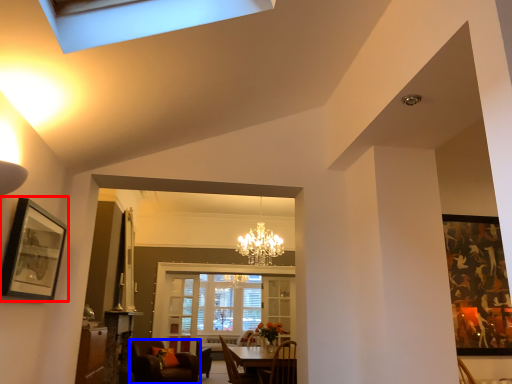
Question: Which point is further to the camera, picture frame (highlighted by a red box) or chair (highlighted by a blue box)?

Choices:
 (A) picture frame
 (B) chair

Answer: (B)